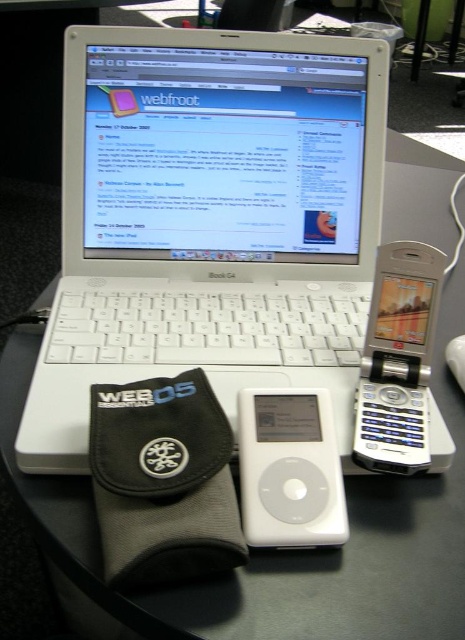
Question: Which object is the farthest from the white matte ipod at center?

Choices:
 (A) white plastic mouse at lower right
 (B) silver metallic flip phone at right
 (C) white plastic laptop at center

Answer: (C)

Question: Which point appears closest to the camera in this image?

Choices:
 (A) (399, 419)
 (B) (330, 400)
 (C) (458, 380)

Answer: (B)

Question: Which object appears farthest from the camera in this image?

Choices:
 (A) white plastic laptop at center
 (B) white plastic mouse at lower right
 (C) white matte ipod at center
 (D) silver metallic flip phone at right

Answer: (B)

Question: Is white plastic laptop at center below white matte ipod at center?

Choices:
 (A) no
 (B) yes

Answer: (A)

Question: Does white plastic laptop at center appear on the left side of white matte ipod at center?

Choices:
 (A) no
 (B) yes

Answer: (B)

Question: Is white plastic laptop at center thinner than silver metallic flip phone at right?

Choices:
 (A) no
 (B) yes

Answer: (A)